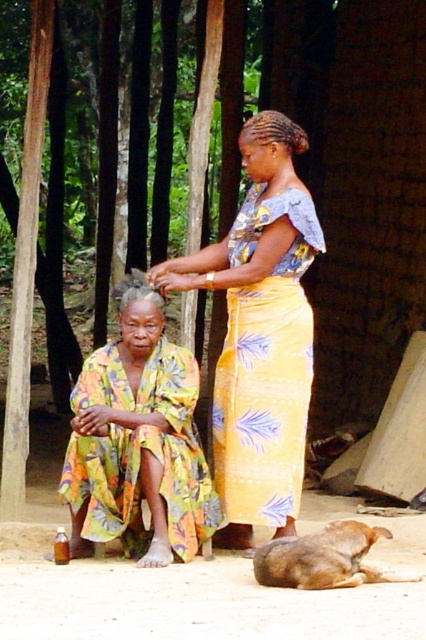
Question: Is printed fabric dress at center closer to camera compared to brown fur dog at lower right?

Choices:
 (A) yes
 (B) no

Answer: (B)

Question: Does yellow printed fabric skirt at center lie in front of brown fur dog at lower right?

Choices:
 (A) no
 (B) yes

Answer: (A)

Question: Among these points, which one is farthest from the camera?

Choices:
 (A) (227, 320)
 (B) (333, 563)
 (C) (161, 477)

Answer: (A)

Question: Is yellow printed fabric skirt at center bigger than brown fur dog at lower right?

Choices:
 (A) no
 (B) yes

Answer: (B)

Question: Which object is the closest to the yellow printed fabric skirt at center?

Choices:
 (A) printed fabric dress at center
 (B) brown fur dog at lower right

Answer: (A)

Question: Which object appears closest to the camera in this image?

Choices:
 (A) printed fabric dress at center
 (B) yellow printed fabric skirt at center

Answer: (A)